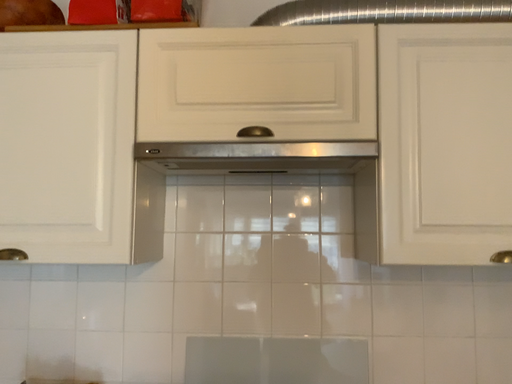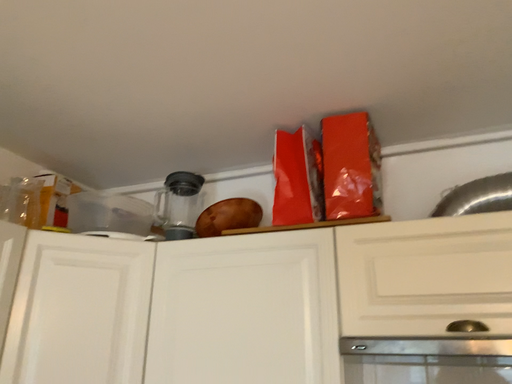
Question: How did the camera likely rotate when shooting the video?

Choices:
 (A) rotated right
 (B) rotated left

Answer: (B)